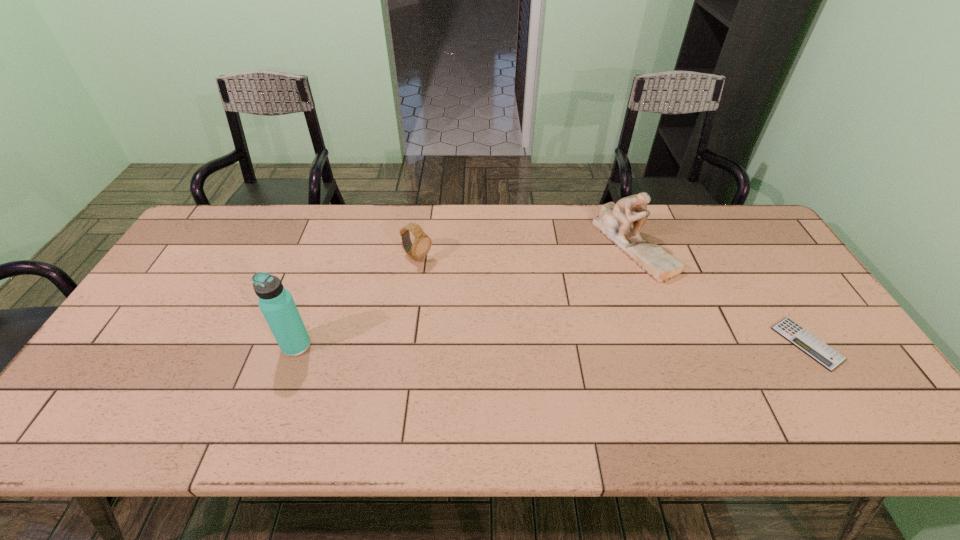
The image size is (960, 540). In order to click on free space on the desktop that is between the leftmost object and the shortest object and is positioned on the face of the second object from left to right in this screenshot , I will do (x=556, y=345).

I want to click on vacant space on the desktop that is between the leftmost object and the calculator and is positioned on the front-facing side of the figurine, so click(624, 344).